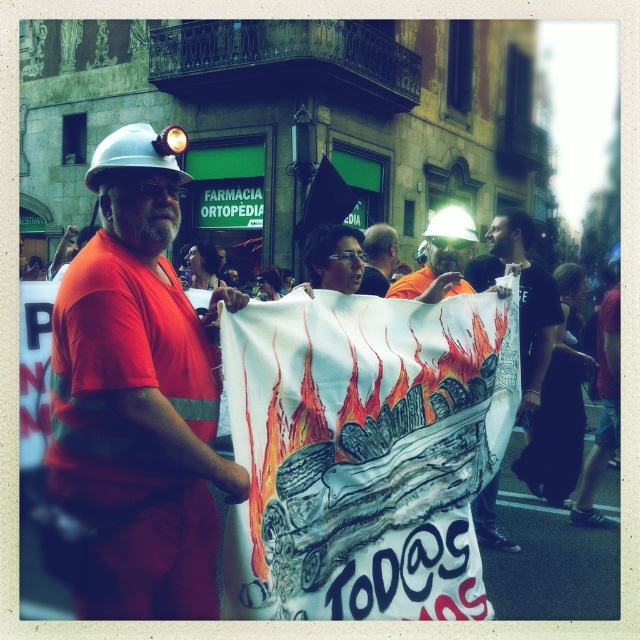
Question: Which point is farther to the camera?

Choices:
 (A) (321, 248)
 (B) (384, 234)
 (C) (428, 252)
 (D) (68, 433)

Answer: (B)

Question: Does matte white helmet at center appear on the right side of orange reflective shirt at center?

Choices:
 (A) yes
 (B) no

Answer: (A)

Question: Is matte orange jumpsuit at center wider than orange reflective shirt at center?

Choices:
 (A) yes
 (B) no

Answer: (A)

Question: Which point appears closest to the camera in this image?

Choices:
 (A) (465, 253)
 (B) (192, 561)
 (C) (522, 388)
 (D) (317, 284)

Answer: (B)

Question: Which point is farther to the camera?

Choices:
 (A) matte black glasses at center
 (B) black t-shirt at center
 (C) matte orange jumpsuit at center
 (D) orange reflective shirt at center

Answer: (B)

Question: Can you confirm if matte orange jumpsuit at center is positioned below matte black glasses at center?

Choices:
 (A) no
 (B) yes

Answer: (B)